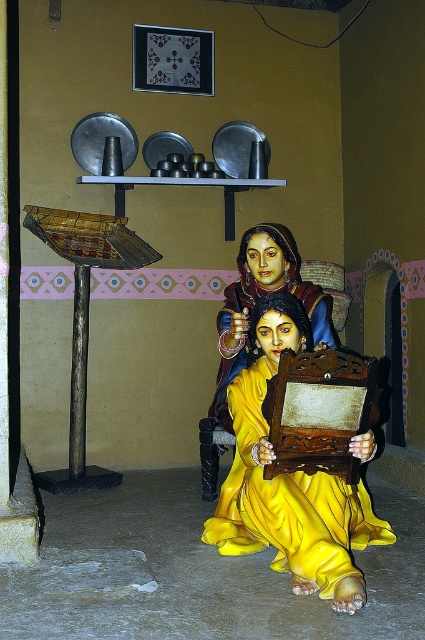
Does yellow satin fabric at center come behind satin yellow dress at center?

No, yellow satin fabric at center is closer to the viewer.

Is yellow satin fabric at center to the right of satin yellow dress at center from the viewer's perspective?

Indeed, yellow satin fabric at center is positioned on the right side of satin yellow dress at center.

The image size is (425, 640). What do you see at coordinates (289, 481) in the screenshot?
I see `yellow satin fabric at center` at bounding box center [289, 481].

Where is `yellow satin fabric at center`? yellow satin fabric at center is located at coordinates (289, 481).